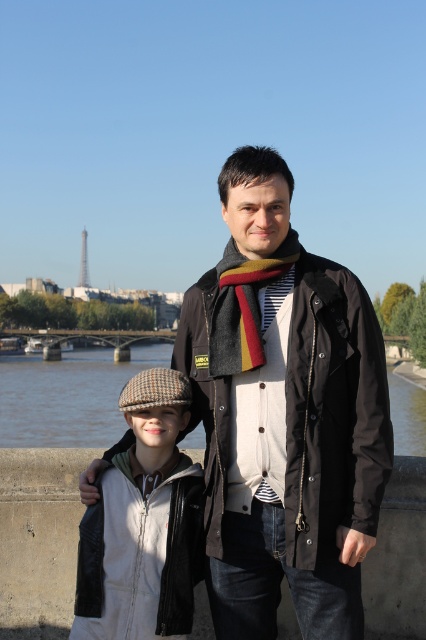
Which is below, dark brown jacket at center or black matte jacket at center?

black matte jacket at center is lower down.

What do you see at coordinates (284, 416) in the screenshot? This screenshot has height=640, width=426. I see `dark brown jacket at center` at bounding box center [284, 416].

At what (x,y) coordinates should I click in order to perform the action: click on dark brown jacket at center. Please return your answer as a coordinate pair (x, y). Looking at the image, I should click on (284, 416).

Is herringbone wool cap at center below striped wool scarf at center?

Correct, herringbone wool cap at center is located below striped wool scarf at center.

Can you confirm if herringbone wool cap at center is positioned above striped wool scarf at center?

Incorrect, herringbone wool cap at center is not positioned above striped wool scarf at center.

Does point (121, 490) come behind point (259, 282)?

No, it is not.

At what (x,y) coordinates should I click in order to perform the action: click on herringbone wool cap at center. Please return your answer as a coordinate pair (x, y). Looking at the image, I should click on (143, 524).

Is black matte jacket at center closer to camera compared to striped wool scarf at center?

Yes, it is.

Is point (322, 346) in front of point (224, 257)?

Yes, it is.

At what (x,y) coordinates should I click in order to perform the action: click on black matte jacket at center. Please return your answer as a coordinate pair (x, y). This screenshot has height=640, width=426. Looking at the image, I should click on (331, 410).